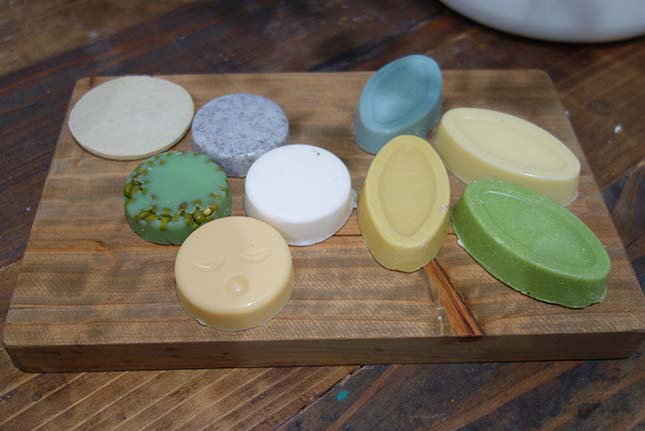
Find the location of a particular element. This screenshot has width=645, height=431. white soap is located at coordinates (303, 211), (148, 109).